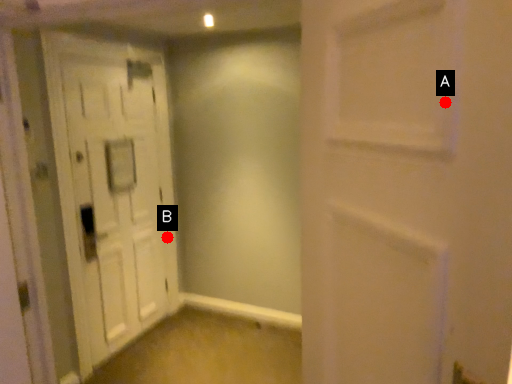
Question: Two points are circled on the image, labeled by A and B beside each circle. Which point is closer to the camera?

Choices:
 (A) A is closer
 (B) B is closer

Answer: (A)